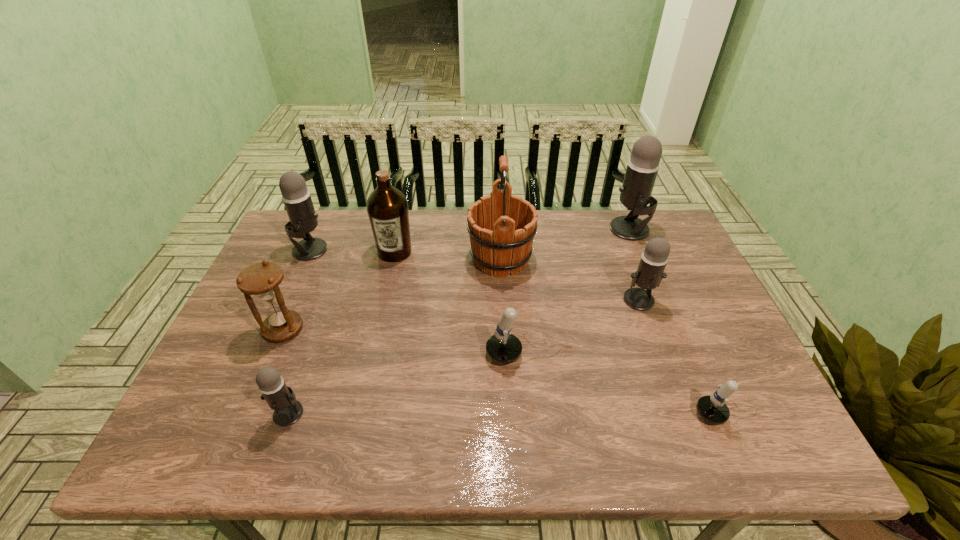
Find the location of a particular element. The image size is (960, 540). object situated at the near right corner is located at coordinates (712, 409).

Find the location of a particular element. The image size is (960, 540). vacant space at the far edge is located at coordinates (458, 228).

This screenshot has height=540, width=960. In order to click on vacant space at the near edge of the desktop in this screenshot , I will do `click(395, 429)`.

The height and width of the screenshot is (540, 960). In the image, there is a desktop. Identify the location of vacant space at the left edge. (229, 406).

In the image, there is a desktop. Identify the location of vacant space at the right edge. (684, 271).

Find the location of `vacant space at the far left corner`. vacant space at the far left corner is located at coordinates (324, 222).

Find the location of `unoccupied area between the hourglass and the wood wine bucket`. unoccupied area between the hourglass and the wood wine bucket is located at coordinates (392, 294).

Where is `unoccupied area between the third nearest microphone and the brown olive oil`? This screenshot has width=960, height=540. unoccupied area between the third nearest microphone and the brown olive oil is located at coordinates (463, 303).

The width and height of the screenshot is (960, 540). I want to click on free point between the farther white microphone and the wine bucket, so click(x=516, y=307).

At what (x,y) coordinates should I click in order to perform the action: click on free spot between the fourth shortest microphone and the wood wine bucket. Please return your answer as a coordinate pair (x, y). The width and height of the screenshot is (960, 540). Looking at the image, I should click on (569, 279).